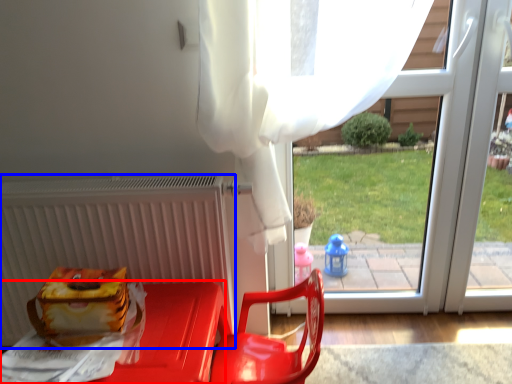
Question: Which point is further to the camera, furniture (highlighted by a red box) or radiator (highlighted by a blue box)?

Choices:
 (A) furniture
 (B) radiator

Answer: (B)